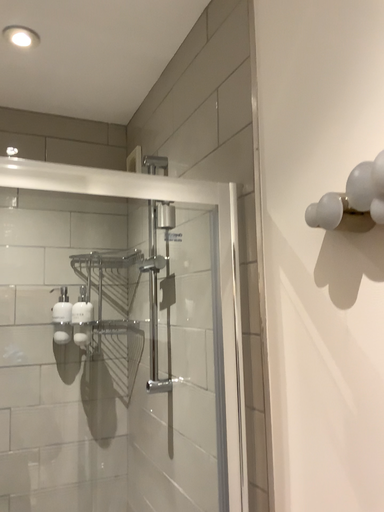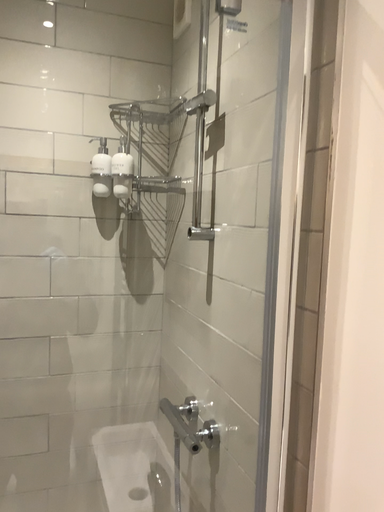
Question: Which way did the camera rotate in the video?

Choices:
 (A) rotated downward
 (B) rotated upward

Answer: (A)